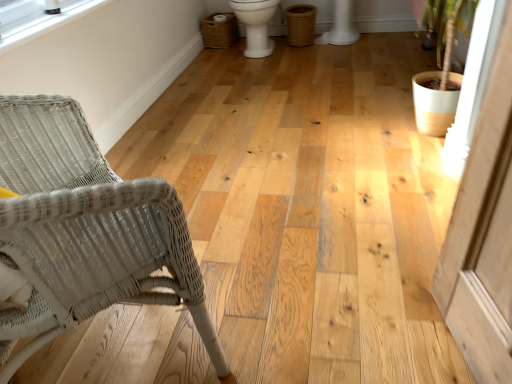
Question: From the image's perspective, is white wicker chair at left located above woven brown laundry basket at upper center?

Choices:
 (A) no
 (B) yes

Answer: (A)

Question: From a real-world perspective, is white wicker chair at left below woven brown laundry basket at upper center?

Choices:
 (A) no
 (B) yes

Answer: (A)

Question: Is white wicker chair at left at the left side of woven brown laundry basket at upper center?

Choices:
 (A) no
 (B) yes

Answer: (B)

Question: Is woven brown laundry basket at upper center surrounded by white wicker chair at left?

Choices:
 (A) no
 (B) yes

Answer: (A)

Question: Is white wicker chair at left turned away from woven brown laundry basket at upper center?

Choices:
 (A) yes
 (B) no

Answer: (B)

Question: Are white wicker chair at left and woven brown laundry basket at upper center located far from each other?

Choices:
 (A) no
 (B) yes

Answer: (B)

Question: Is woven brown laundry basket at upper center thinner than clear plastic window screen at upper left?

Choices:
 (A) yes
 (B) no

Answer: (B)

Question: Considering the relative positions of woven brown laundry basket at upper center and clear plastic window screen at upper left in the image provided, is woven brown laundry basket at upper center in front of clear plastic window screen at upper left?

Choices:
 (A) yes
 (B) no

Answer: (B)

Question: Can you confirm if woven brown laundry basket at upper center is bigger than clear plastic window screen at upper left?

Choices:
 (A) no
 (B) yes

Answer: (B)

Question: Is woven brown laundry basket at upper center facing away from clear plastic window screen at upper left?

Choices:
 (A) no
 (B) yes

Answer: (A)

Question: Can you confirm if woven brown laundry basket at upper center is positioned to the left of clear plastic window screen at upper left?

Choices:
 (A) yes
 (B) no

Answer: (B)

Question: Is woven brown laundry basket at upper center located outside clear plastic window screen at upper left?

Choices:
 (A) yes
 (B) no

Answer: (A)

Question: Is woven brown laundry basket at upper center beside white glossy toilet bowl at center?

Choices:
 (A) no
 (B) yes

Answer: (A)